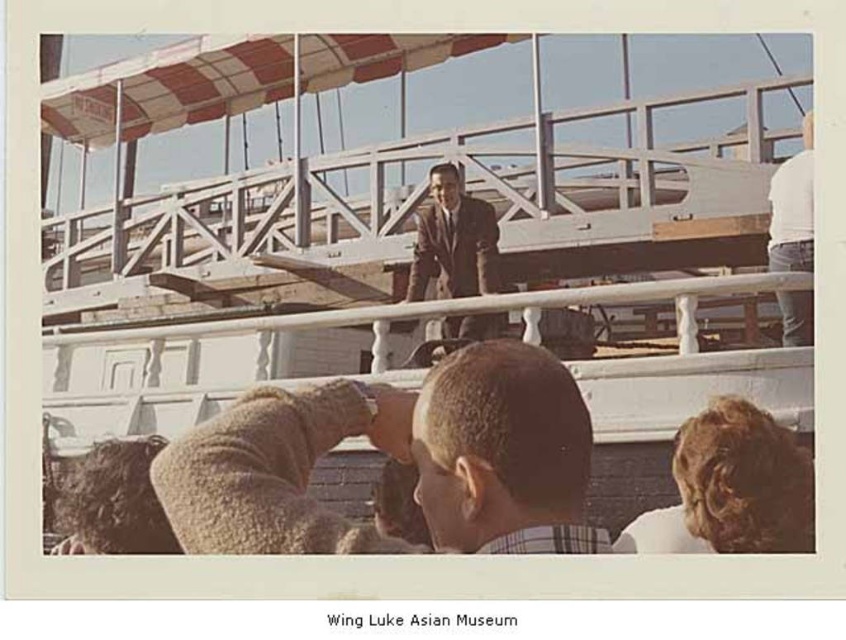
Question: Which object appears farthest from the camera in this image?

Choices:
 (A) light brown hair at center
 (B) matte brown suit at center
 (C) white cotton shirt at upper right

Answer: (B)

Question: Which point is farther to the camera?

Choices:
 (A) (448, 230)
 (B) (778, 218)
 (C) (523, 436)

Answer: (A)

Question: Which object appears closest to the camera in this image?

Choices:
 (A) white cotton shirt at upper right
 (B) matte brown suit at center

Answer: (A)

Question: Is light brown hair at center bigger than white cotton shirt at upper right?

Choices:
 (A) no
 (B) yes

Answer: (A)

Question: Can you confirm if matte brown suit at center is wider than white cotton shirt at upper right?

Choices:
 (A) no
 (B) yes

Answer: (A)

Question: Does light brown hair at center have a greater width compared to white cotton shirt at upper right?

Choices:
 (A) no
 (B) yes

Answer: (A)